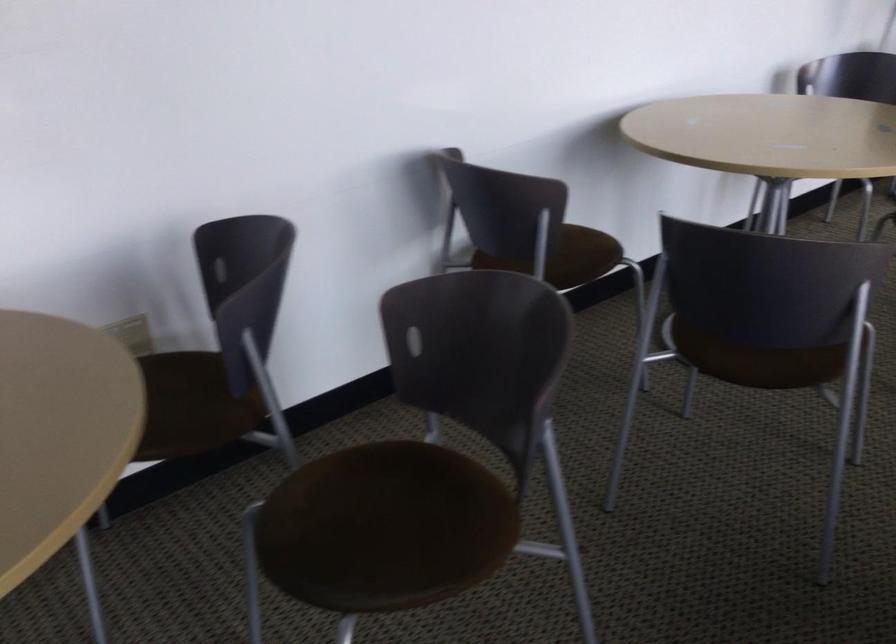
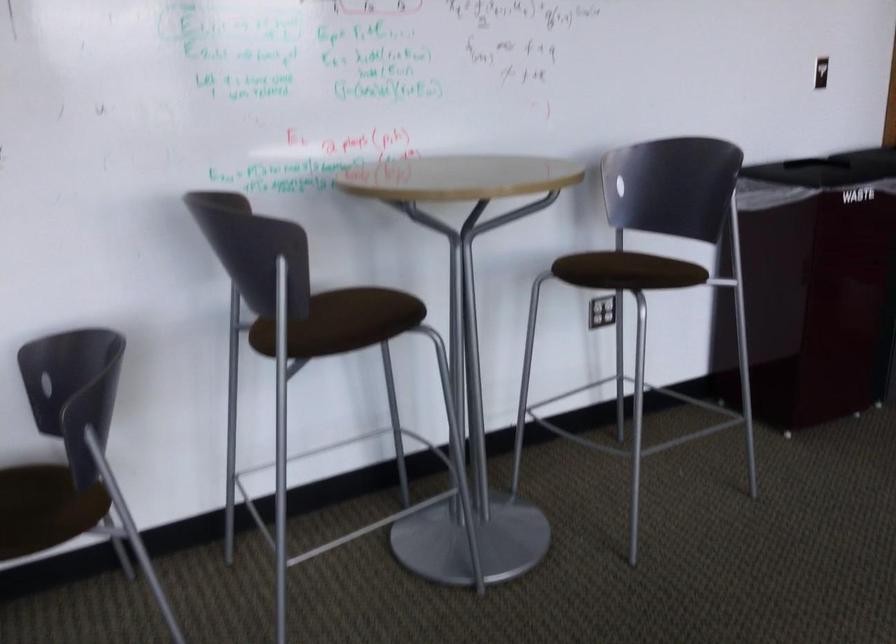
In a continuous first-person perspective shot, in which direction is the camera moving?

The cameraman moved toward right, forward.